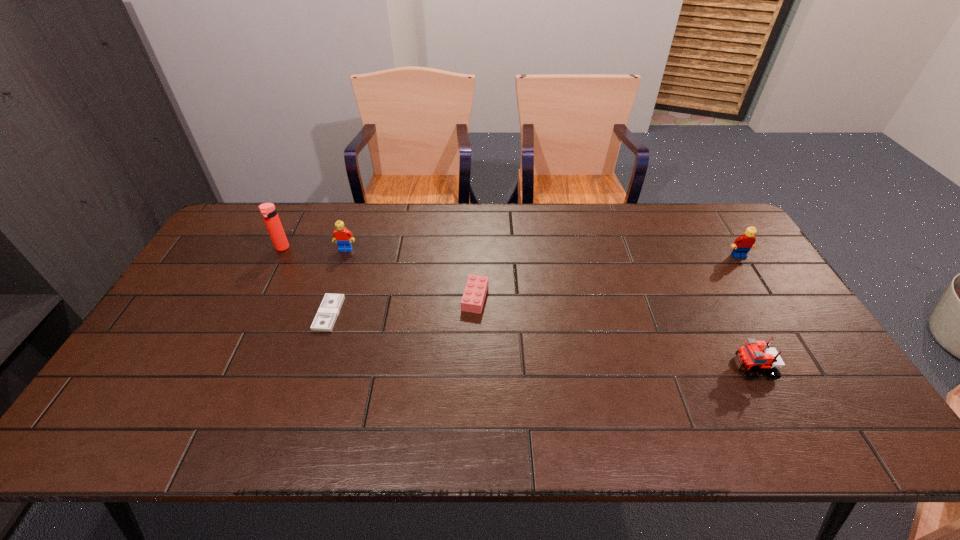
Locate an element on the screen. thermos bottle is located at coordinates (268, 211).

Locate an element on the screen. The height and width of the screenshot is (540, 960). the tallest object is located at coordinates (268, 211).

Where is `the third nearest Lego`? the third nearest Lego is located at coordinates (742, 245).

In order to click on the rightmost Lego in this screenshot , I will do `click(742, 245)`.

The image size is (960, 540). I want to click on the farthest Lego, so click(343, 237).

Locate an element on the screen. Image resolution: width=960 pixels, height=540 pixels. the second Lego from right to left is located at coordinates (755, 355).

Identify the location of the fourth tallest object. (755, 355).

Identify the location of the shortest Lego. This screenshot has width=960, height=540. (475, 291).

Identify the location of the second shortest object. (475, 291).

You are a GUI agent. You are given a task and a screenshot of the screen. Output one action in this format:
    pyautogui.click(x=<x>, y=<y>)
    Task: Click on the dollar
    The image size is (960, 540).
    Given the screenshot: What is the action you would take?
    pyautogui.click(x=326, y=316)